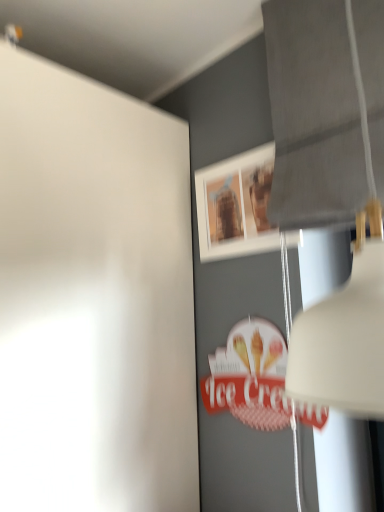
Question: Does matte wooden picture frame at upper center have a lesser height compared to white matte lampshade at upper right?

Choices:
 (A) yes
 (B) no

Answer: (A)

Question: Can you confirm if matte wooden picture frame at upper center is taller than white matte lampshade at upper right?

Choices:
 (A) no
 (B) yes

Answer: (A)

Question: Would you say white matte lampshade at upper right is part of matte wooden picture frame at upper center's contents?

Choices:
 (A) yes
 (B) no

Answer: (B)

Question: Is matte wooden picture frame at upper center further to the viewer compared to white matte lampshade at upper right?

Choices:
 (A) yes
 (B) no

Answer: (A)

Question: Is matte wooden picture frame at upper center wider than white matte lampshade at upper right?

Choices:
 (A) no
 (B) yes

Answer: (A)

Question: From a real-world perspective, is matte wooden picture frame at upper center located higher than white matte lampshade at upper right?

Choices:
 (A) no
 (B) yes

Answer: (B)

Question: From a real-world perspective, is white matte lampshade at upper right over matte wooden picture frame at upper center?

Choices:
 (A) no
 (B) yes

Answer: (A)

Question: Considering the relative sizes of white matte lampshade at upper right and matte wooden picture frame at upper center in the image provided, is white matte lampshade at upper right smaller than matte wooden picture frame at upper center?

Choices:
 (A) yes
 (B) no

Answer: (B)

Question: Could matte wooden picture frame at upper center be considered to be inside white matte lampshade at upper right?

Choices:
 (A) yes
 (B) no

Answer: (B)

Question: From the image's perspective, is white matte lampshade at upper right under matte wooden picture frame at upper center?

Choices:
 (A) no
 (B) yes

Answer: (A)

Question: Does white matte lampshade at upper right lie behind matte wooden picture frame at upper center?

Choices:
 (A) yes
 (B) no

Answer: (B)

Question: Does white matte lampshade at upper right have a larger size compared to matte wooden picture frame at upper center?

Choices:
 (A) no
 (B) yes

Answer: (B)

Question: From a real-world perspective, is matte wooden picture frame at upper center physically located above or below white matte lampshade at upper right?

Choices:
 (A) below
 (B) above

Answer: (B)